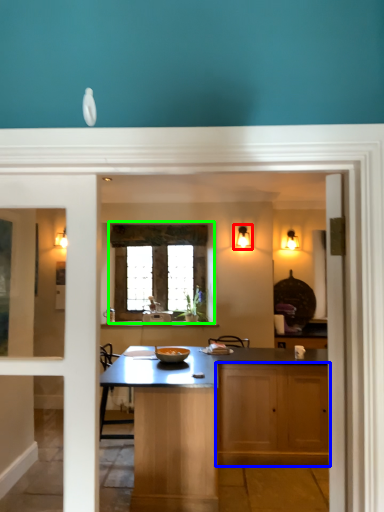
Question: Considering the real-world distances, which object is closest to light fixture (highlighted by a red box)? cabinetry (highlighted by a blue box) or window (highlighted by a green box).

Choices:
 (A) cabinetry
 (B) window

Answer: (B)